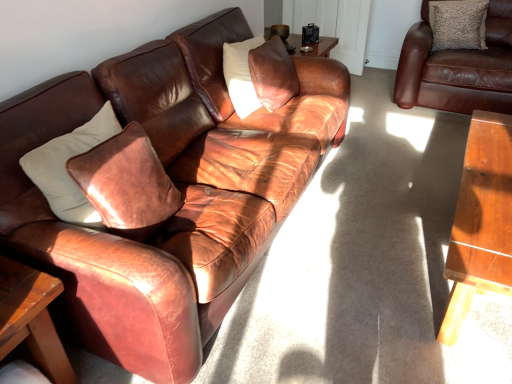
Where is `textured beige pillow at upper right, arranged as the 1th pillow when viewed from the right`? textured beige pillow at upper right, arranged as the 1th pillow when viewed from the right is located at coordinates (458, 24).

You are a GUI agent. You are given a task and a screenshot of the screen. Output one action in this format:
    pyautogui.click(x=<x>, y=<y>)
    Task: Click on the brown leather couch at upper right, which is counted as the second studio couch, starting from the left
    This screenshot has width=512, height=384.
    Given the screenshot: What is the action you would take?
    pyautogui.click(x=457, y=68)

Does brown leather couch at upper right, the first studio couch positioned from the right, appear on the right side of matte brown leather couch at left, marked as the 1th studio couch in a left-to-right arrangement?

Correct, you'll find brown leather couch at upper right, the first studio couch positioned from the right, to the right of matte brown leather couch at left, marked as the 1th studio couch in a left-to-right arrangement.

Is point (407, 43) positioned in front of point (184, 124)?

That is False.

The image size is (512, 384). What are the coordinates of `studio couch in front of the brown leather couch at upper right, which is counted as the second studio couch, starting from the left` in the screenshot? It's located at (165, 190).

Looking at their sizes, would you say brown leather couch at upper right, which is counted as the second studio couch, starting from the left, is wider or thinner than matte brown leather couch at left, which is the 2th studio couch in right-to-left order?

In the image, brown leather couch at upper right, which is counted as the second studio couch, starting from the left, appears to be more narrow than matte brown leather couch at left, which is the 2th studio couch in right-to-left order.

Is brown leather couch at upper right, which is counted as the second studio couch, starting from the left, with wooden table at lower left?

No.

From the image's perspective, which studio couch is the 2nd one above the wooden table at lower left? Please provide its 2D coordinates.

[(457, 68)]

Is brown leather couch at upper right, which is counted as the second studio couch, starting from the left, in front of or behind wooden table at lower left in the image?

In the image, brown leather couch at upper right, which is counted as the second studio couch, starting from the left, appears behind wooden table at lower left.

Between brown leather couch at upper right, the first studio couch positioned from the right, and wooden table at lower left, which one has larger width?

With larger width is brown leather couch at upper right, the first studio couch positioned from the right.

Which object is positioned more to the left, textured beige pillow at upper right, marked as the 2th pillow in a bottom-to-top arrangement, or brown leather couch at upper right, the first studio couch positioned from the right?

Positioned to the left is textured beige pillow at upper right, marked as the 2th pillow in a bottom-to-top arrangement.

In terms of size, does textured beige pillow at upper right, arranged as the 1th pillow when viewed from the right, appear bigger or smaller than brown leather couch at upper right, the first studio couch positioned from the right?

textured beige pillow at upper right, arranged as the 1th pillow when viewed from the right, is smaller than brown leather couch at upper right, the first studio couch positioned from the right.

How many degrees apart are the facing directions of textured beige pillow at upper right, the second pillow from the front, and brown leather couch at upper right, the first studio couch positioned from the right?

They differ by 1.55 degrees in their facing directions.

Considering the positions of objects wooden table at lower left and leather pillow at center, the 1th pillow in the bottom-to-top sequence, in the image provided, who is in front, wooden table at lower left or leather pillow at center, the 1th pillow in the bottom-to-top sequence,?

wooden table at lower left.

From the image's perspective, does wooden table at lower left appear higher than leather pillow at center, the 1th pillow in the bottom-to-top sequence?

No.

Is wooden table at lower left beside leather pillow at center, the second pillow from the back?

They are not placed beside each other.

Which is less distant, [21,266] or [277,50]?

The point [21,266] is more forward.

From a real-world perspective, who is located lower, matte brown leather couch at left, marked as the 1th studio couch in a left-to-right arrangement, or brown leather couch at upper right, the first studio couch positioned from the right?

brown leather couch at upper right, the first studio couch positioned from the right, is physically lower.

Is matte brown leather couch at left, which is the 2th studio couch in right-to-left order, further to the viewer compared to brown leather couch at upper right, the first studio couch positioned from the right?

No, matte brown leather couch at left, which is the 2th studio couch in right-to-left order, is in front of brown leather couch at upper right, the first studio couch positioned from the right.

Is matte brown leather couch at left, marked as the 1th studio couch in a left-to-right arrangement, next to brown leather couch at upper right, which is counted as the second studio couch, starting from the left, and touching it?

They are not placed beside each other.

Is matte brown leather couch at left, which is the 2th studio couch in right-to-left order, surrounded by leather pillow at center, the first pillow in the front-to-back sequence?

No, leather pillow at center, the first pillow in the front-to-back sequence, does not contain matte brown leather couch at left, which is the 2th studio couch in right-to-left order.

Considering their positions, is leather pillow at center, which ranks as the 2th pillow in right-to-left order, located in front of or behind matte brown leather couch at left, which is the 2th studio couch in right-to-left order?

leather pillow at center, which ranks as the 2th pillow in right-to-left order, is positioned farther from the viewer than matte brown leather couch at left, which is the 2th studio couch in right-to-left order.

Looking at this image, can you confirm if leather pillow at center, acting as the first pillow starting from the left, is shorter than matte brown leather couch at left, which is the 2th studio couch in right-to-left order?

Yes, leather pillow at center, acting as the first pillow starting from the left, is shorter than matte brown leather couch at left, which is the 2th studio couch in right-to-left order.

From a real-world perspective, which is physically below, leather pillow at center, the second pillow from the back, or matte brown leather couch at left, marked as the 1th studio couch in a left-to-right arrangement?

From a 3D spatial view, matte brown leather couch at left, marked as the 1th studio couch in a left-to-right arrangement, is below.

Looking at this image, which is less distant, (281, 75) or (41, 328)?

Point (41, 328)

Would you consider leather pillow at center, acting as the first pillow starting from the left, to be distant from wooden table at lower left?

That's right, there is a large distance between leather pillow at center, acting as the first pillow starting from the left, and wooden table at lower left.

Is leather pillow at center, which ranks as the 2th pillow in right-to-left order, inside or outside of wooden table at lower left?

leather pillow at center, which ranks as the 2th pillow in right-to-left order, is spatially situated outside wooden table at lower left.

What are the coordinates of `studio couch that is on the left side of brown leather couch at upper right, which is counted as the second studio couch, starting from the left` in the screenshot? It's located at (165, 190).

Identify the location of table located below the brown leather couch at upper right, which is counted as the second studio couch, starting from the left (from the image's perspective). The height and width of the screenshot is (384, 512). (31, 317).

Estimate the real-world distances between objects in this image. Which object is further from leather pillow at center, which ranks as the 2th pillow in right-to-left order, wooden table at lower left or matte brown leather couch at left, marked as the 1th studio couch in a left-to-right arrangement?

The object further to leather pillow at center, which ranks as the 2th pillow in right-to-left order, is wooden table at lower left.

When comparing their distances from brown leather couch at upper right, which is counted as the second studio couch, starting from the left, does leather pillow at center, the first pillow in the front-to-back sequence, or matte brown leather couch at left, marked as the 1th studio couch in a left-to-right arrangement, seem closer?

The object closer to brown leather couch at upper right, which is counted as the second studio couch, starting from the left, is leather pillow at center, the first pillow in the front-to-back sequence.

Which object lies nearer to the anchor point leather pillow at center, which ranks as the 2th pillow in right-to-left order, brown leather couch at upper right, which is counted as the second studio couch, starting from the left, or wooden table at lower left?

The object closer to leather pillow at center, which ranks as the 2th pillow in right-to-left order, is brown leather couch at upper right, which is counted as the second studio couch, starting from the left.

Which object lies further to the anchor point wooden table at lower left, matte brown leather couch at left, which is the 2th studio couch in right-to-left order, or leather pillow at center, the first pillow in the front-to-back sequence?

The object further to wooden table at lower left is leather pillow at center, the first pillow in the front-to-back sequence.

Estimate the real-world distances between objects in this image. Which object is further from leather pillow at center, the second pillow from the back, matte brown leather couch at left, marked as the 1th studio couch in a left-to-right arrangement, or wooden table at lower left?

wooden table at lower left is positioned further to the anchor leather pillow at center, the second pillow from the back.

Looking at the image, which one is located closer to textured beige pillow at upper right, the 1th pillow viewed from the top, matte brown leather couch at left, marked as the 1th studio couch in a left-to-right arrangement, or brown leather couch at upper right, which is counted as the second studio couch, starting from the left?

Among the two, brown leather couch at upper right, which is counted as the second studio couch, starting from the left, is located nearer to textured beige pillow at upper right, the 1th pillow viewed from the top.

Which object lies nearer to the anchor point brown leather couch at upper right, the first studio couch positioned from the right, matte brown leather couch at left, which is the 2th studio couch in right-to-left order, or wooden table at lower left?

matte brown leather couch at left, which is the 2th studio couch in right-to-left order, is closer to brown leather couch at upper right, the first studio couch positioned from the right.

Based on their spatial positions, is brown leather couch at upper right, the first studio couch positioned from the right, or wooden table at lower left closer to textured beige pillow at upper right, marked as the 2th pillow in a bottom-to-top arrangement?

Among the two, brown leather couch at upper right, the first studio couch positioned from the right, is located nearer to textured beige pillow at upper right, marked as the 2th pillow in a bottom-to-top arrangement.

Locate an element on the screen. This screenshot has width=512, height=384. pillow between leather pillow at center, the first pillow in the front-to-back sequence, and brown leather couch at upper right, the first studio couch positioned from the right is located at coordinates (458, 24).

Identify the location of studio couch situated between wooden table at lower left and brown leather couch at upper right, the first studio couch positioned from the right, from left to right. (165, 190).

You are a GUI agent. You are given a task and a screenshot of the screen. Output one action in this format:
    pyautogui.click(x=<x>, y=<y>)
    Task: Click on the table between matte brown leather couch at left, marked as the 1th studio couch in a left-to-right arrangement, and leather pillow at center, acting as the first pillow starting from the left, from front to back
    This screenshot has width=512, height=384.
    Given the screenshot: What is the action you would take?
    pyautogui.click(x=31, y=317)

Find the location of a particular element. This screenshot has width=512, height=384. studio couch between matte brown leather couch at left, marked as the 1th studio couch in a left-to-right arrangement, and textured beige pillow at upper right, marked as the 2th pillow in a bottom-to-top arrangement, in the front-back direction is located at coordinates (457, 68).